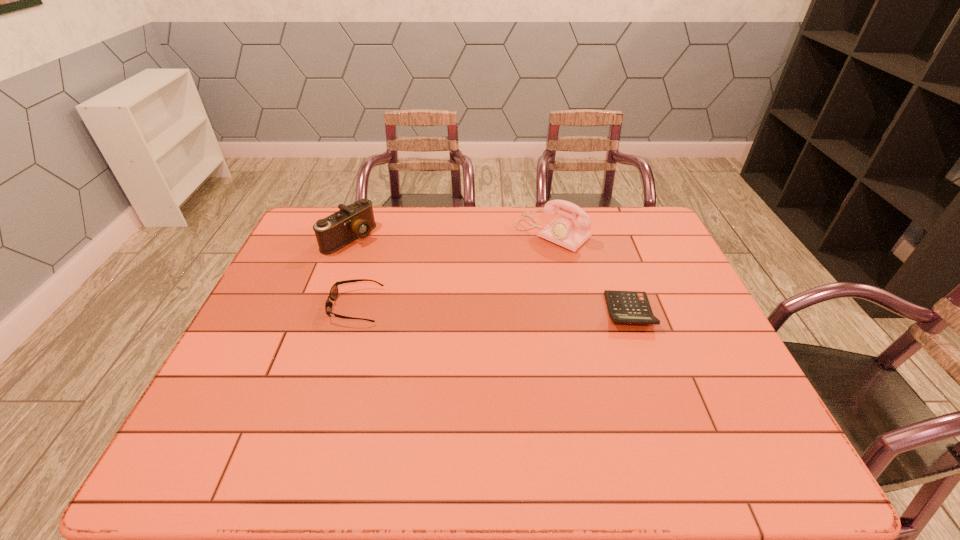
Where is `sunglasses`? The image size is (960, 540). sunglasses is located at coordinates (333, 294).

The image size is (960, 540). I want to click on calculator, so click(x=633, y=307).

Locate an element on the screen. The image size is (960, 540). telephone is located at coordinates (569, 233).

You are a GUI agent. You are given a task and a screenshot of the screen. Output one action in this format:
    pyautogui.click(x=<x>, y=<y>)
    Task: Click on the camera
    The height and width of the screenshot is (540, 960).
    Given the screenshot: What is the action you would take?
    pyautogui.click(x=356, y=220)

Where is `vacant space located on the front-facing side of the sunglasses`? vacant space located on the front-facing side of the sunglasses is located at coordinates tap(309, 306).

Where is `vacant area situated 0.090m on the front-facing side of the sunglasses`? vacant area situated 0.090m on the front-facing side of the sunglasses is located at coordinates (299, 306).

Locate an element on the screen. Image resolution: width=960 pixels, height=540 pixels. vacant space situated on the front-facing side of the sunglasses is located at coordinates (313, 306).

The width and height of the screenshot is (960, 540). In order to click on free space located 0.200m on the front of the calculator in this screenshot , I will do (660, 397).

Where is `free region located on the dial of the tallest object`? This screenshot has height=540, width=960. free region located on the dial of the tallest object is located at coordinates (516, 263).

The height and width of the screenshot is (540, 960). Find the location of `free space located 0.300m on the dial of the tallest object`. free space located 0.300m on the dial of the tallest object is located at coordinates (474, 299).